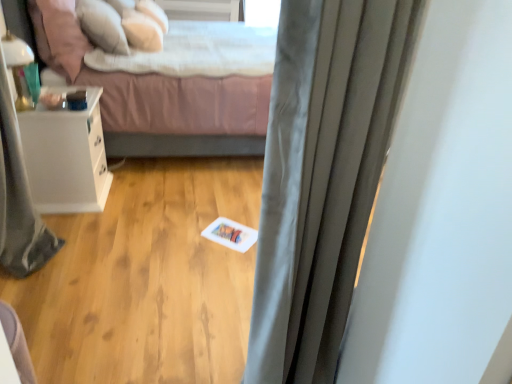
What are the coordinates of `vacant point to the right of white glossy nightstand at left` in the screenshot? It's located at (138, 198).